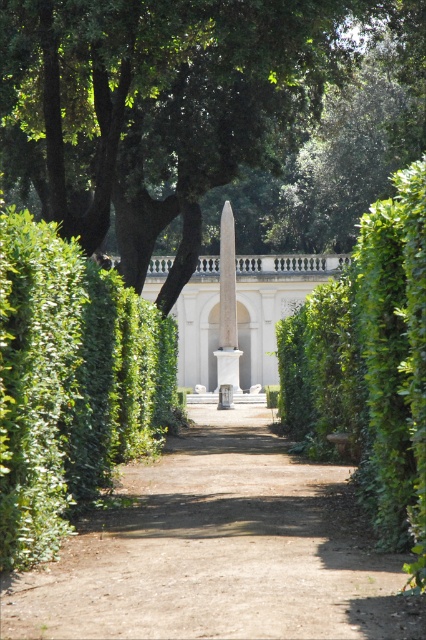
Question: Does green leafy tree at center have a greater width compared to polished marble obelisk at center?

Choices:
 (A) no
 (B) yes

Answer: (B)

Question: Which object is positioned closest to the polished marble obelisk at center?

Choices:
 (A) green leafy hedge at left
 (B) dirt path at center
 (C) green leafy hedge at center

Answer: (C)

Question: Which object is the closest to the polished marble obelisk at center?

Choices:
 (A) green leafy hedge at center
 (B) green leafy hedge at left
 (C) green leafy tree at center
 (D) dirt path at center

Answer: (C)

Question: Is dirt path at center positioned behind green leafy hedge at center?

Choices:
 (A) no
 (B) yes

Answer: (A)

Question: Considering the relative positions of dirt path at center and polished marble obelisk at center in the image provided, where is dirt path at center located with respect to polished marble obelisk at center?

Choices:
 (A) above
 (B) below

Answer: (B)

Question: Which of these objects is positioned farthest from the green leafy hedge at center?

Choices:
 (A) green leafy hedge at left
 (B) green leafy tree at center
 (C) dirt path at center
 (D) polished marble obelisk at center

Answer: (D)